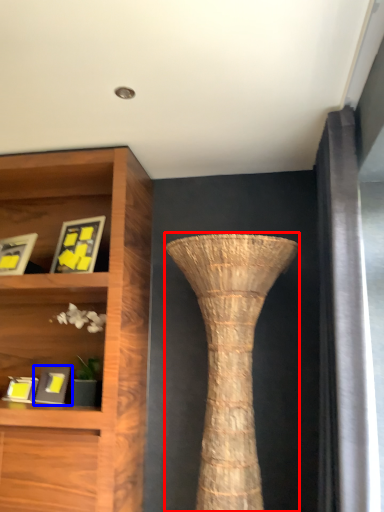
Question: Which of the following is the closest to the observer, vase (highlighted by a red box) or picture frame (highlighted by a blue box)?

Choices:
 (A) vase
 (B) picture frame

Answer: (A)